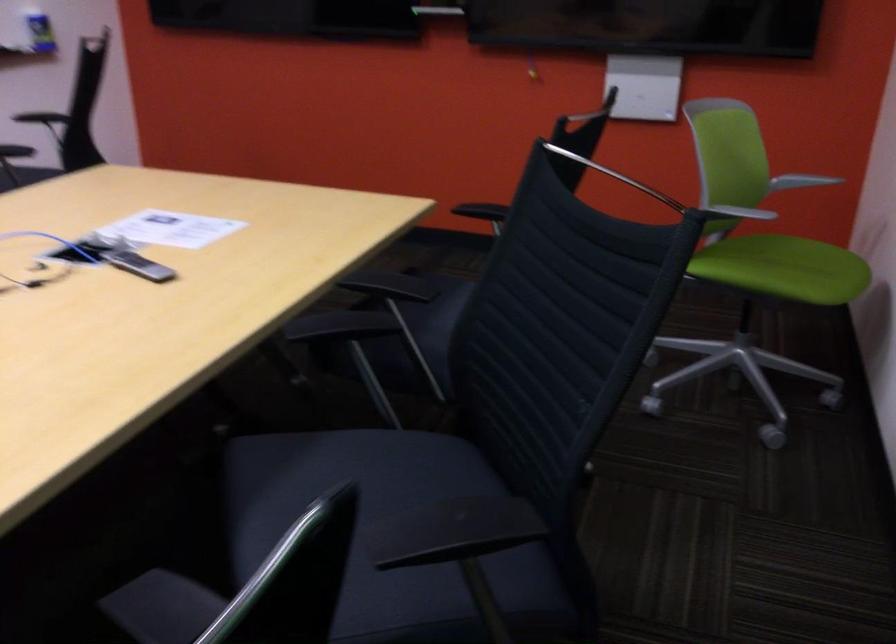
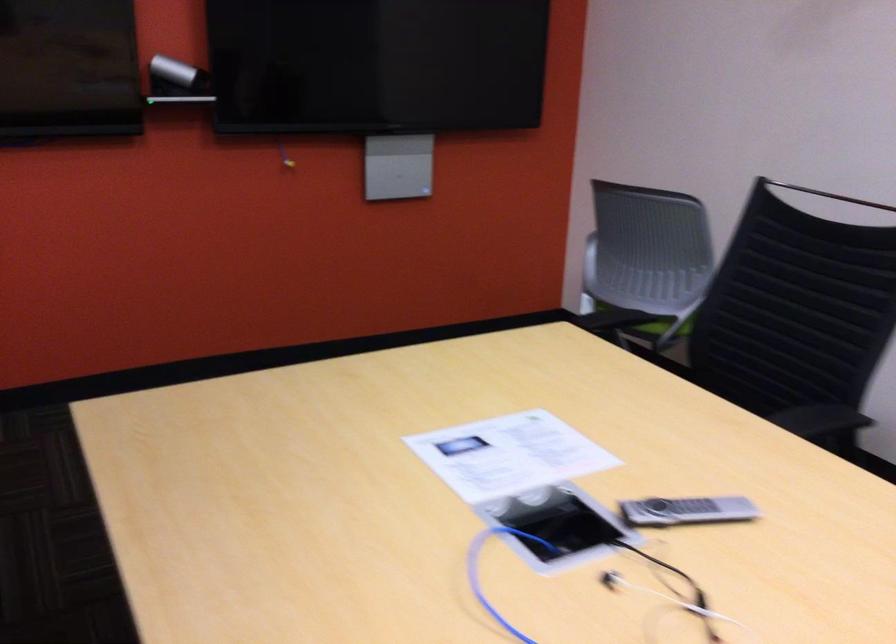
Find the pixel in the second image that matches pixel 699 281 in the first image.

(653, 325)